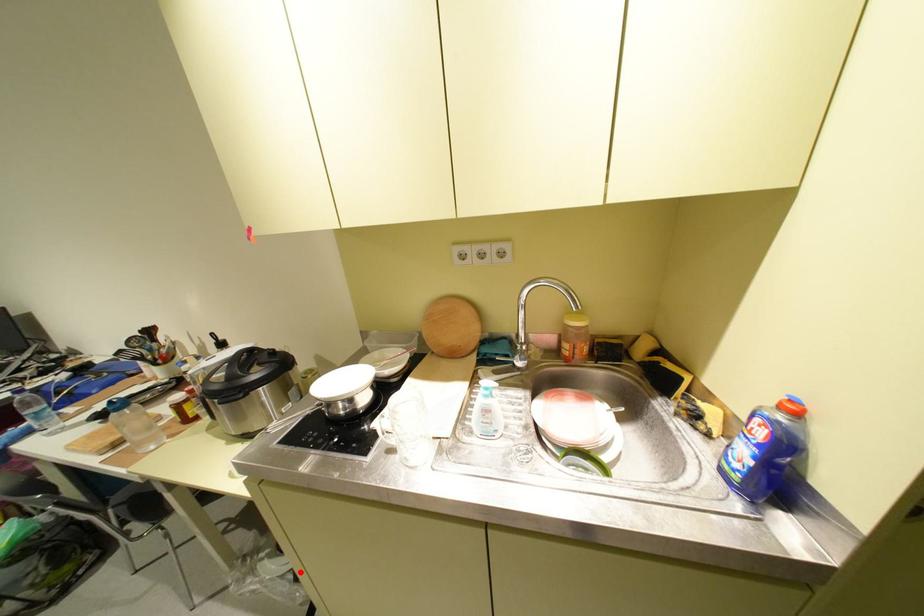
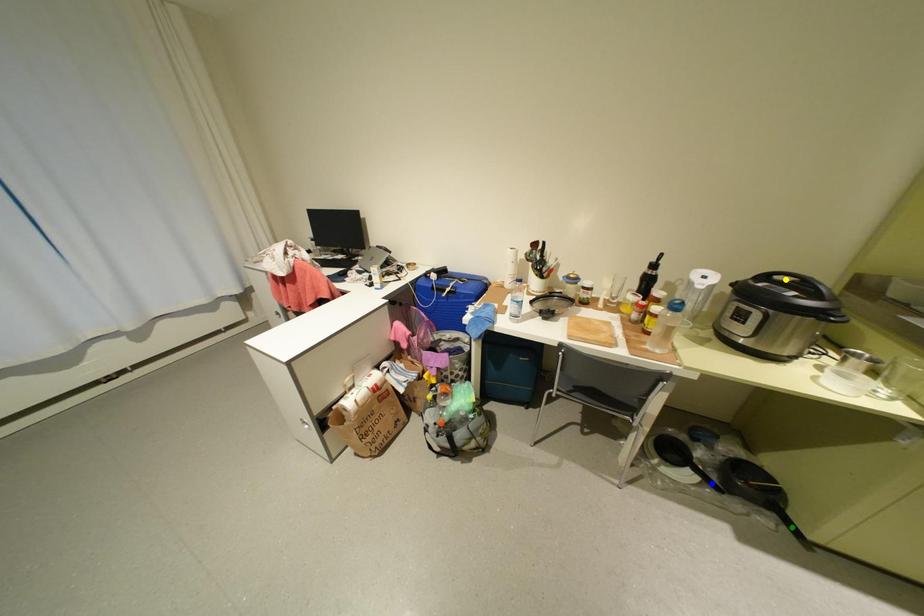
Question: I am providing you with two images of the same scene from different viewpoints. A red point is marked on the first image. You are given multiple points on the second image. Which spot in image 2 lines up with the point in image 1?

Choices:
 (A) yellow point
 (B) green point
 (C) blue point

Answer: (C)